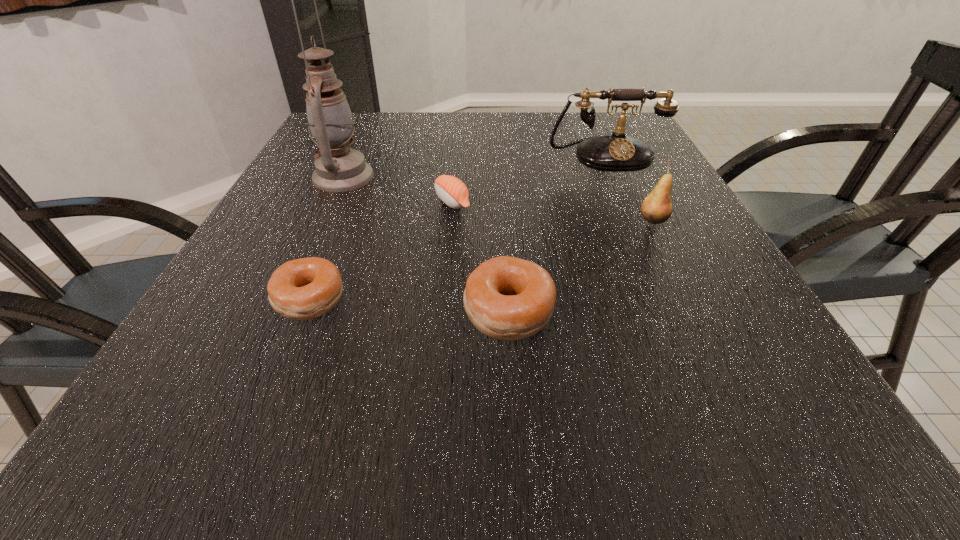
You are a GUI agent. You are given a task and a screenshot of the screen. Output one action in this format:
    pyautogui.click(x=<x>, y=<y>)
    Task: Click on the vacant region located on the left of the sushi
    
    Given the screenshot: What is the action you would take?
    pyautogui.click(x=324, y=202)

What are the coordinates of `blank area located on the front of the tallest object` in the screenshot? It's located at (288, 296).

I want to click on vacant space located 0.070m on the back of the pear, so click(640, 195).

Find the location of a particular element. This screenshot has height=540, width=960. object present at the far edge is located at coordinates (616, 153).

At what (x,y) coordinates should I click in order to perform the action: click on object present at the near edge. Please return your answer as a coordinate pair (x, y). The image size is (960, 540). Looking at the image, I should click on (506, 298).

I want to click on bagel that is at the left edge, so click(303, 289).

Where is `oil lamp present at the left edge`? Image resolution: width=960 pixels, height=540 pixels. oil lamp present at the left edge is located at coordinates (339, 168).

Locate an element on the screen. The width and height of the screenshot is (960, 540). telephone situated at the right edge is located at coordinates (616, 153).

The width and height of the screenshot is (960, 540). Find the location of `pear that is positioned at the right edge`. pear that is positioned at the right edge is located at coordinates (656, 208).

You are a GUI agent. You are given a task and a screenshot of the screen. Output one action in this format:
    pyautogui.click(x=<x>, y=<y>)
    Task: Click on the object present at the far right corner
    The height and width of the screenshot is (540, 960).
    Given the screenshot: What is the action you would take?
    pyautogui.click(x=616, y=153)